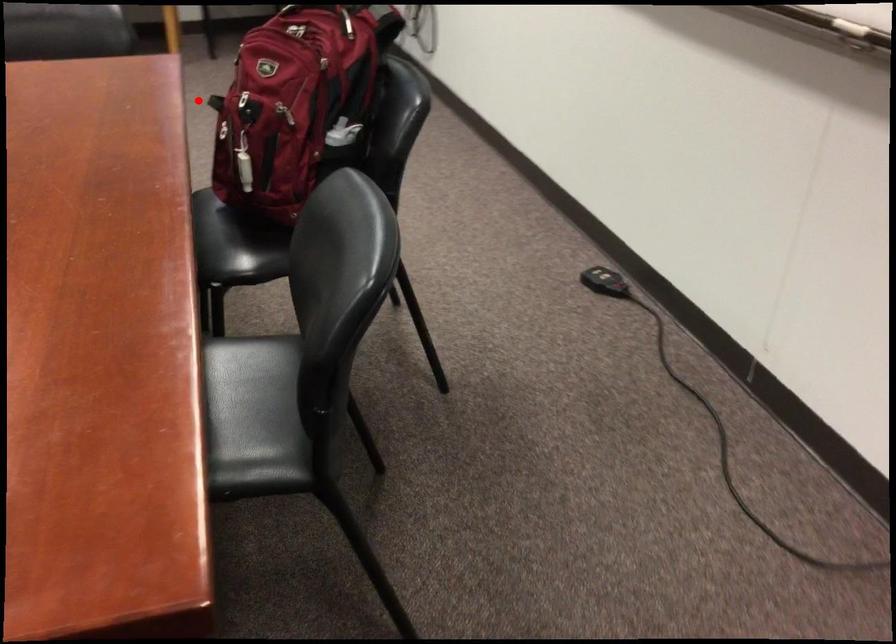
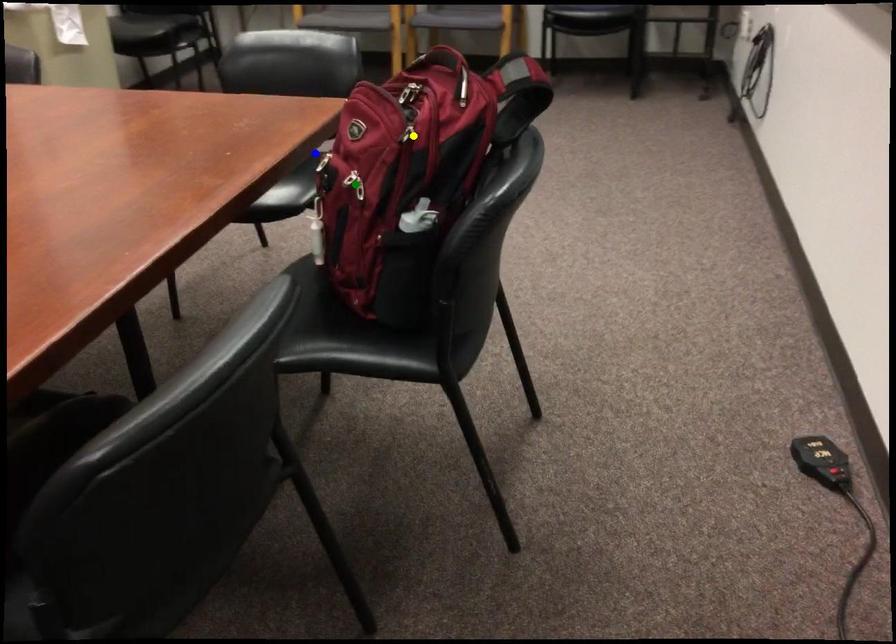
Question: I am providing you with two images of the same scene from different viewpoints. A red point is marked on the first image. You are given multiple points on the second image. In image 2, which mark is for the same physical point as the one in image 1?

Choices:
 (A) green point
 (B) blue point
 (C) yellow point

Answer: (B)